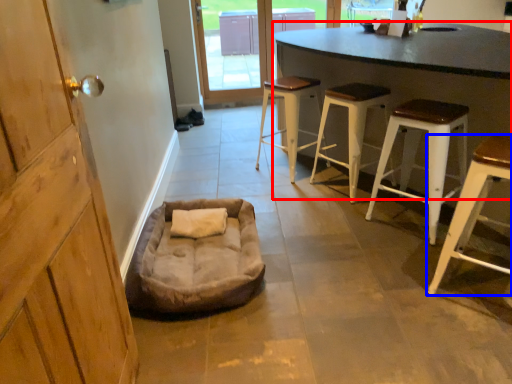
Question: Which object appears farthest to the camera in this image, table (highlighted by a red box) or stool (highlighted by a blue box)?

Choices:
 (A) table
 (B) stool

Answer: (B)